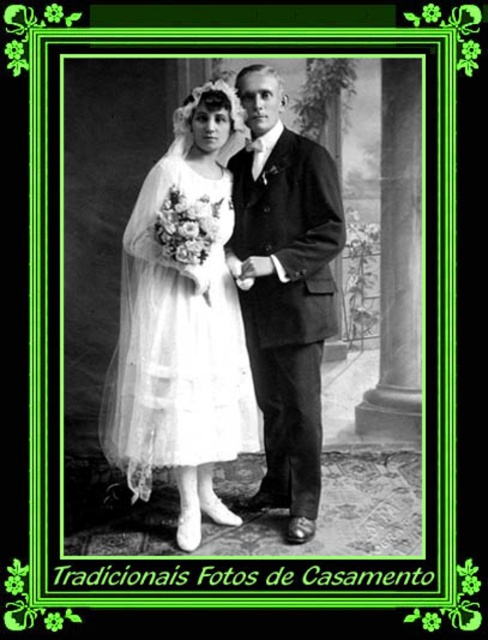
Does translucent white tulle dress at center have a larger size compared to smooth black suit at center?

Indeed, translucent white tulle dress at center has a larger size compared to smooth black suit at center.

Image resolution: width=488 pixels, height=640 pixels. What do you see at coordinates (177, 342) in the screenshot? I see `translucent white tulle dress at center` at bounding box center [177, 342].

Image resolution: width=488 pixels, height=640 pixels. What do you see at coordinates (177, 342) in the screenshot?
I see `translucent white tulle dress at center` at bounding box center [177, 342].

This screenshot has height=640, width=488. Identify the location of translucent white tulle dress at center. (177, 342).

Can you confirm if white lace dress at center is positioned above smooth black suit at center?

Yes, white lace dress at center is above smooth black suit at center.

Is white lace dress at center closer to camera compared to smooth black suit at center?

Yes.

Measure the distance between point (180, 128) and camera.

The distance of point (180, 128) from camera is 2.84 meters.

In order to click on white lace dress at center in this screenshot , I will do `click(226, 307)`.

Does white lace dress at center appear under translucent white tulle dress at center?

No.

Based on the photo, can you confirm if white lace dress at center is bigger than translucent white tulle dress at center?

Yes, white lace dress at center is bigger than translucent white tulle dress at center.

Where is `white lace dress at center`? The width and height of the screenshot is (488, 640). white lace dress at center is located at coordinates (226, 307).